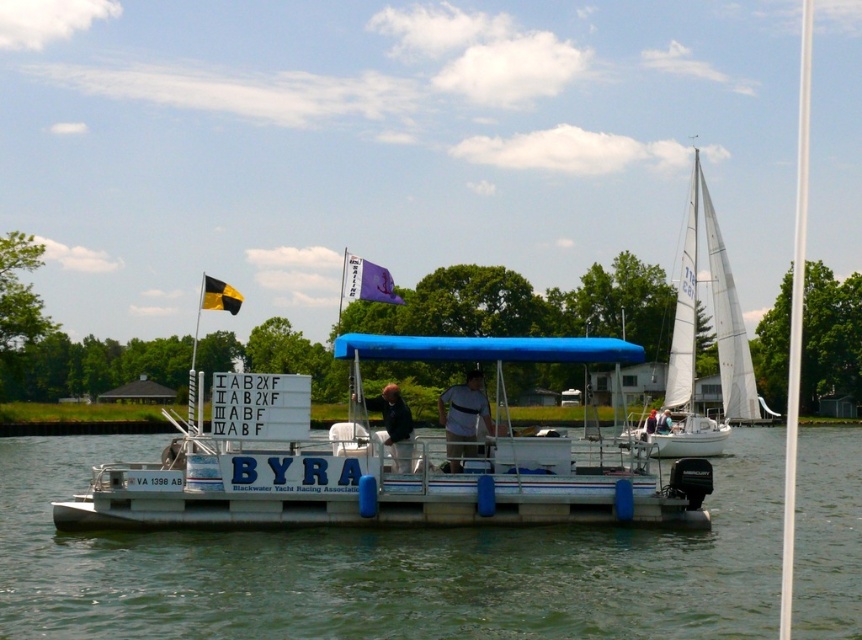
Can you confirm if white sail at right is positioned above black matte jacket at center?

Yes.

Describe the element at coordinates (695, 342) in the screenshot. I see `white sail at right` at that location.

Locate an element on the screen. This screenshot has width=862, height=640. white sail at right is located at coordinates (695, 342).

Can you confirm if white sail at right is thinner than light blue fabric shirt at center?

Incorrect, white sail at right's width is not less than light blue fabric shirt at center's.

Does white sail at right appear on the left side of light blue fabric shirt at center?

In fact, white sail at right is to the right of light blue fabric shirt at center.

Which is behind, point (711, 212) or point (659, 417)?

Point (711, 212)

You are a GUI agent. You are given a task and a screenshot of the screen. Output one action in this format:
    pyautogui.click(x=<x>, y=<y>)
    Task: Click on the white sail at right
    
    Given the screenshot: What is the action you would take?
    pyautogui.click(x=695, y=342)

Is point (447, 394) closer to camera compared to point (667, 432)?

Yes, point (447, 394) is closer to viewer.

What are the coordinates of `white matte shirt at center` in the screenshot? It's located at (463, 417).